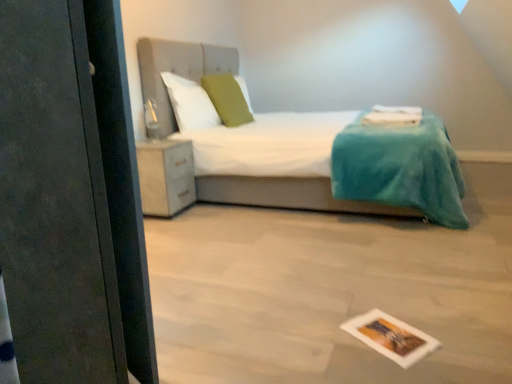
What are the coordinates of `free area in between white fabric bed at center and printed paper postcard at lower center` in the screenshot? It's located at (320, 268).